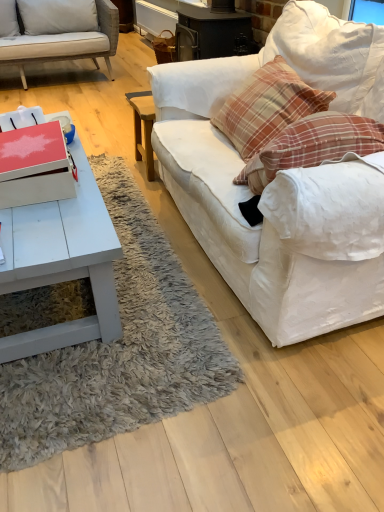
You are a GUI agent. You are given a task and a screenshot of the screen. Output one action in this format:
    pyautogui.click(x=<x>, y=<y>)
    Task: Click on the plaid fabric pillow at upper right
    This screenshot has height=512, width=384.
    Given the screenshot: What is the action you would take?
    pyautogui.click(x=267, y=106)

This screenshot has height=512, width=384. I want to click on white matte coffee table at lower left, so click(x=62, y=261).

Is white fabric couch at right wider than white matte coffee table at lower left?

In fact, white fabric couch at right might be narrower than white matte coffee table at lower left.

What's the angular difference between white fabric couch at right and white matte coffee table at lower left's facing directions?

90 degrees separate the facing orientations of white fabric couch at right and white matte coffee table at lower left.

Are white fabric couch at right and white matte coffee table at lower left making contact?

white fabric couch at right is not next to white matte coffee table at lower left, and they're not touching.

Is white fabric couch at right not within white matte coffee table at lower left?

That's correct, white fabric couch at right is outside of white matte coffee table at lower left.

Can you confirm if white fabric couch at right is shorter than plaid fabric pillow at upper right?

No.

Which object is further away from the camera, white fabric couch at right or plaid fabric pillow at upper right?

plaid fabric pillow at upper right is further from the camera.

Does white fabric couch at right appear on the right side of plaid fabric pillow at upper right?

Indeed, white fabric couch at right is positioned on the right side of plaid fabric pillow at upper right.

Considering the positions of point (90, 333) and point (305, 311), is point (90, 333) closer or farther from the camera than point (305, 311)?

Clearly, point (90, 333) is more distant from the camera than point (305, 311).

From a real-world perspective, which is physically above, white matte coffee table at lower left or white fabric couch at right?

white fabric couch at right, from a real-world perspective.

Is white matte coffee table at lower left oriented away from white fabric couch at right?

No, white matte coffee table at lower left's orientation is not away from white fabric couch at right.

How distant is white matte coffee table at lower left from white fabric couch at right?

The distance of white matte coffee table at lower left from white fabric couch at right is 23.16 inches.

At what (x,y) coordinates should I click in order to perform the action: click on coffee table that is on the left side of plaid fabric pillow at upper right. Please return your answer as a coordinate pair (x, y). The width and height of the screenshot is (384, 512). Looking at the image, I should click on (62, 261).

Is plaid fabric pillow at upper right at the back of white matte coffee table at lower left?

No, white matte coffee table at lower left is not facing the opposite direction of plaid fabric pillow at upper right.

Looking at the image, does white matte coffee table at lower left seem bigger or smaller compared to plaid fabric pillow at upper right?

white matte coffee table at lower left is bigger than plaid fabric pillow at upper right.

Considering their positions, is white matte coffee table at lower left located in front of or behind plaid fabric pillow at upper right?

white matte coffee table at lower left is positioned closer to the viewer than plaid fabric pillow at upper right.

Identify the location of studio couch in front of the plaid fabric pillow at upper right. This screenshot has width=384, height=512. tap(282, 182).

From the image's perspective, who appears lower, plaid fabric pillow at upper right or white fabric couch at right?

From the image's view, white fabric couch at right is below.

Can you tell me how much plaid fabric pillow at upper right and white fabric couch at right differ in facing direction?

They differ by 1.71 degrees in their facing directions.

Between point (279, 76) and point (370, 187), which one is positioned in front?

The point (370, 187) is closer.

How different are the orientations of plaid fabric pillow at upper right and white matte coffee table at lower left in degrees?

The facing directions of plaid fabric pillow at upper right and white matte coffee table at lower left are 91.7 degrees apart.

From the image's perspective, is plaid fabric pillow at upper right on top of white matte coffee table at lower left?

Yes.

Is point (293, 114) positioned in front of point (112, 307)?

No.

Are plaid fabric pillow at upper right and white matte coffee table at lower left beside each other?

plaid fabric pillow at upper right and white matte coffee table at lower left are not in contact.

Find the location of a particular element. The width and height of the screenshot is (384, 512). studio couch that appears on the right of white matte coffee table at lower left is located at coordinates (282, 182).

Find the location of a particular element. The image size is (384, 512). studio couch below the plaid fabric pillow at upper right (from the image's perspective) is located at coordinates (282, 182).

When comparing their distances from white fabric couch at right, does white matte coffee table at lower left or plaid fabric pillow at upper right seem closer?

plaid fabric pillow at upper right is closer to white fabric couch at right.

From the image, which object appears to be farther from white matte coffee table at lower left, white fabric couch at right or plaid fabric pillow at upper right?

Based on the image, plaid fabric pillow at upper right appears to be further to white matte coffee table at lower left.

Estimate the real-world distances between objects in this image. Which object is closer to white matte coffee table at lower left, plaid fabric pillow at upper right or white fabric couch at right?

white fabric couch at right lies closer to white matte coffee table at lower left than the other object.

From the picture: When comparing their distances from plaid fabric pillow at upper right, does white fabric couch at right or white matte coffee table at lower left seem further?

white matte coffee table at lower left.

From the image, which object appears to be nearer to plaid fabric pillow at upper right, white matte coffee table at lower left or white fabric couch at right?

white fabric couch at right.

Considering their positions, is plaid fabric pillow at upper right positioned closer to white fabric couch at right than white matte coffee table at lower left?

Based on the image, plaid fabric pillow at upper right appears to be nearer to white fabric couch at right.

This screenshot has width=384, height=512. I want to click on pillow situated between white matte coffee table at lower left and white fabric couch at right from left to right, so click(267, 106).